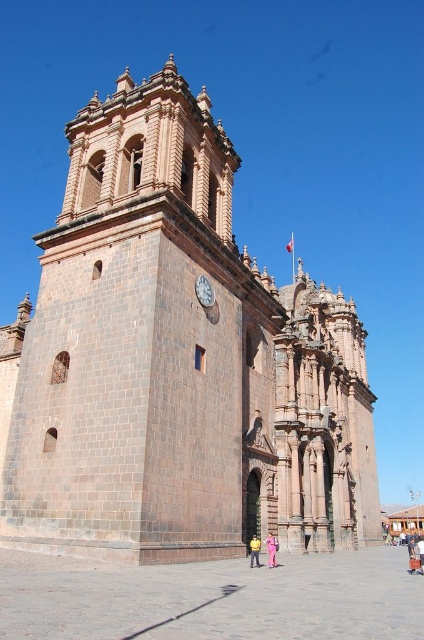
Which of these two, brown stone church at center or yellow fabric person at lower center, stands shorter?

yellow fabric person at lower center is shorter.

Is point (214, 401) farther from camera compared to point (253, 547)?

That is True.

Identify the location of brown stone church at center. Image resolution: width=424 pixels, height=640 pixels. (175, 362).

Is matte stone clock at center above yellow fabric person at lower center?

Yes.

Based on the photo, between matte stone clock at center and yellow fabric person at lower center, which one has more height?

yellow fabric person at lower center

The image size is (424, 640). Identify the location of matte stone clock at center. (203, 291).

At what (x,y) coordinates should I click in order to perform the action: click on matte stone clock at center. Please return your answer as a coordinate pair (x, y). The image size is (424, 640). Looking at the image, I should click on (203, 291).

Who is more distant from viewer, (181, 115) or (276, 547)?

The point (181, 115) is more distant.

Which is behind, point (345, 376) or point (268, 545)?

The point (345, 376) is more distant.

The height and width of the screenshot is (640, 424). Identify the location of brown stone church at center. (175, 362).